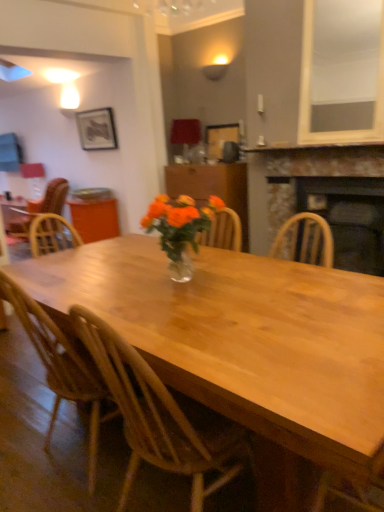
How much space does matte black picture frame at upper left, which ranks as the first picture frame in left-to-right order, occupy horizontally?

3.32 inches.

What is the approximate height of wooden at left, which is the 2th chair in right-to-left order?

The height of wooden at left, which is the 2th chair in right-to-left order, is 38.18 inches.

What do you see at coordinates (212, 187) in the screenshot? I see `wooden cabinet at center` at bounding box center [212, 187].

The width and height of the screenshot is (384, 512). Find the location of `wooden chair at center, the third chair viewed from the back`. wooden chair at center, the third chair viewed from the back is located at coordinates (159, 417).

This screenshot has height=512, width=384. I want to click on translucent glass vase at center, so click(x=179, y=228).

In terms of width, does rustic stone fireplace at right, marked as the second fireplace in a bottom-to-top arrangement, look wider or thinner when compared to matte black picture frame at upper left, the second picture frame positioned from the right?

Clearly, rustic stone fireplace at right, marked as the second fireplace in a bottom-to-top arrangement, has more width compared to matte black picture frame at upper left, the second picture frame positioned from the right.

From a real-world perspective, is rustic stone fireplace at right, which ranks as the 1th fireplace in top-to-bottom order, over matte black picture frame at upper left, which ranks as the first picture frame in left-to-right order?

No, from a real-world perspective, rustic stone fireplace at right, which ranks as the 1th fireplace in top-to-bottom order, is not over matte black picture frame at upper left, which ranks as the first picture frame in left-to-right order

Is rustic stone fireplace at right, marked as the second fireplace in a bottom-to-top arrangement, at the right side of matte black picture frame at upper left, which ranks as the first picture frame in left-to-right order?

Yes.

Is rustic stone fireplace at right, marked as the second fireplace in a bottom-to-top arrangement, oriented away from matte black picture frame at upper left, the second picture frame when ordered from front to back?

rustic stone fireplace at right, marked as the second fireplace in a bottom-to-top arrangement, is not turned away from matte black picture frame at upper left, the second picture frame when ordered from front to back.

Does wooden picture frame at upper center, the 1th picture frame when ordered from bottom to top, appear on the right side of wooden chair at center, the 1th chair in the front-to-back sequence?

Yes, wooden picture frame at upper center, the 1th picture frame when ordered from bottom to top, is to the right of wooden chair at center, the 1th chair in the front-to-back sequence.

Image resolution: width=384 pixels, height=512 pixels. In order to click on picture frame on the right of wooden chair at center, the 3th chair in the left-to-right sequence in this screenshot , I will do `click(220, 138)`.

Looking at this image, does wooden picture frame at upper center, placed as the 1th picture frame when sorted from front to back, have a smaller size compared to wooden chair at center, the 1th chair in the front-to-back sequence?

Indeed, wooden picture frame at upper center, placed as the 1th picture frame when sorted from front to back, has a smaller size compared to wooden chair at center, the 1th chair in the front-to-back sequence.

Does point (66, 338) come closer to viewer compared to point (222, 130)?

Yes, it is.

What's the angular difference between wooden at left, which ranks as the 2th chair in left-to-right order, and wooden picture frame at upper center, which is the second picture frame from left to right,'s facing directions?

There is a 179-degree angle between the facing directions of wooden at left, which ranks as the 2th chair in left-to-right order, and wooden picture frame at upper center, which is the second picture frame from left to right.

Are wooden at left, which is counted as the 2th chair, starting from the back, and wooden picture frame at upper center, the 1th picture frame when ordered from bottom to top, located far from each other?

Yes, wooden at left, which is counted as the 2th chair, starting from the back, is far from wooden picture frame at upper center, the 1th picture frame when ordered from bottom to top.

Is wooden at left, which is the 2th chair in right-to-left order, spatially inside wooden picture frame at upper center, which is the second picture frame from left to right, or outside of it?

wooden at left, which is the 2th chair in right-to-left order, is located beyond the bounds of wooden picture frame at upper center, which is the second picture frame from left to right.

From the image's perspective, is wooden picture frame at upper center, marked as the first picture frame in a right-to-left arrangement, on top of matte black picture frame at upper left, positioned as the 1th picture frame in top-to-bottom order?

No, from the image's perspective, wooden picture frame at upper center, marked as the first picture frame in a right-to-left arrangement, is not over matte black picture frame at upper left, positioned as the 1th picture frame in top-to-bottom order.

Looking at the image, does wooden picture frame at upper center, which appears as the 2th picture frame when viewed from the top, seem bigger or smaller compared to matte black picture frame at upper left, the second picture frame when ordered from front to back?

Clearly, wooden picture frame at upper center, which appears as the 2th picture frame when viewed from the top, is smaller in size than matte black picture frame at upper left, the second picture frame when ordered from front to back.

Is point (238, 126) behind point (98, 137)?

No, (238, 126) is in front of (98, 137).

Is point (209, 139) positioned after point (292, 150)?

Yes, it is behind point (292, 150).

Is wooden picture frame at upper center, marked as the first picture frame in a right-to-left arrangement, in contact with stone fireplace at upper center?

No, wooden picture frame at upper center, marked as the first picture frame in a right-to-left arrangement, is not making contact with stone fireplace at upper center.

From a real-world perspective, is wooden picture frame at upper center, placed as the 1th picture frame when sorted from front to back, on top of stone fireplace at upper center?

Yes.

Which object is positioned more to the right, wooden picture frame at upper center, placed as the 1th picture frame when sorted from front to back, or stone fireplace at upper center?

From the viewer's perspective, stone fireplace at upper center appears more on the right side.

Is wooden chair at left, acting as the first chair starting from the left, not near wooden picture frame at upper center, the 2th picture frame from the back?

That's right, there is a large distance between wooden chair at left, acting as the first chair starting from the left, and wooden picture frame at upper center, the 2th picture frame from the back.

The width and height of the screenshot is (384, 512). I want to click on the 1st picture frame positioned above the wooden chair at left, which is the 3th chair from front to back (from the image's perspective), so click(220, 138).

From the image's perspective, which is below, wooden chair at left, arranged as the first chair when viewed from the back, or wooden picture frame at upper center, the 1th picture frame when ordered from bottom to top?

wooden chair at left, arranged as the first chair when viewed from the back, from the image's perspective.

Which is in front, point (23, 221) or point (228, 131)?

The point (23, 221) is more forward.

Is wooden chair at center, the third chair viewed from the back, not inside rustic stone fireplace at right, which ranks as the 1th fireplace in top-to-bottom order?

Absolutely, wooden chair at center, the third chair viewed from the back, is external to rustic stone fireplace at right, which ranks as the 1th fireplace in top-to-bottom order.

Considering the sizes of objects wooden chair at center, the third chair viewed from the back, and rustic stone fireplace at right, which ranks as the 1th fireplace in top-to-bottom order, in the image provided, who is bigger, wooden chair at center, the third chair viewed from the back, or rustic stone fireplace at right, which ranks as the 1th fireplace in top-to-bottom order,?

rustic stone fireplace at right, which ranks as the 1th fireplace in top-to-bottom order, is bigger.

From a real-world perspective, between wooden chair at center, the 1th chair in the front-to-back sequence, and rustic stone fireplace at right, which ranks as the 1th fireplace in top-to-bottom order, who is vertically lower?

wooden chair at center, the 1th chair in the front-to-back sequence.

Identify the location of the 2nd fireplace in front of the matte black picture frame at upper left, marked as the first picture frame in a back-to-front arrangement. This screenshot has width=384, height=512. (329, 197).

Locate an element on the screen. The height and width of the screenshot is (512, 384). chair that is the 3rd one below the wooden picture frame at upper center, which is the second picture frame from left to right (from a real-world perspective) is located at coordinates (159, 417).

Which object lies further to the anchor point translucent glass vase at center, wooden picture frame at upper center, which appears as the 2th picture frame when viewed from the top, or rustic stone fireplace at right, marked as the second fireplace in a bottom-to-top arrangement?

wooden picture frame at upper center, which appears as the 2th picture frame when viewed from the top, lies further to translucent glass vase at center than the other object.

Looking at the image, which one is located closer to wooden picture frame at upper center, the 2th picture frame from the back, translucent glass vase at center or stone fireplace at upper center?

stone fireplace at upper center lies closer to wooden picture frame at upper center, the 2th picture frame from the back, than the other object.

Which object lies further to the anchor point wooden picture frame at upper center, the 1th picture frame when ordered from bottom to top, rustic stone fireplace at right, marked as the second fireplace in a bottom-to-top arrangement, or black stone fireplace at center, which is the 1th fireplace in bottom-to-top order?

black stone fireplace at center, which is the 1th fireplace in bottom-to-top order, lies further to wooden picture frame at upper center, the 1th picture frame when ordered from bottom to top, than the other object.

From the picture: Considering their positions, is rustic stone fireplace at right, marked as the second fireplace in a bottom-to-top arrangement, positioned closer to black stone fireplace at center, which is the 1th fireplace in bottom-to-top order, than stone fireplace at upper center?

Among the two, rustic stone fireplace at right, marked as the second fireplace in a bottom-to-top arrangement, is located nearer to black stone fireplace at center, which is the 1th fireplace in bottom-to-top order.

Based on their spatial positions, is wooden chair at center, acting as the 1th chair starting from the right, or rustic stone fireplace at right, marked as the second fireplace in a bottom-to-top arrangement, closer to wooden chair at left, arranged as the first chair when viewed from the back?

rustic stone fireplace at right, marked as the second fireplace in a bottom-to-top arrangement.

In the scene shown: Looking at the image, which one is located further to wooden chair at center, the 3th chair in the left-to-right sequence, wooden chair at left, acting as the first chair starting from the left, or wooden picture frame at upper center, marked as the first picture frame in a right-to-left arrangement?

wooden chair at left, acting as the first chair starting from the left, lies further to wooden chair at center, the 3th chair in the left-to-right sequence, than the other object.

Looking at the image, which one is located further to matte black picture frame at upper left, positioned as the 1th picture frame in top-to-bottom order, wooden chair at left, which appears as the 3th chair when viewed from the right, or wooden chair at center, the third chair viewed from the back?

Among the two, wooden chair at center, the third chair viewed from the back, is located further to matte black picture frame at upper left, positioned as the 1th picture frame in top-to-bottom order.

Which object lies nearer to the anchor point wooden cabinet at center, wooden picture frame at upper center, placed as the 1th picture frame when sorted from front to back, or translucent glass vase at center?

wooden picture frame at upper center, placed as the 1th picture frame when sorted from front to back, is closer to wooden cabinet at center.

The image size is (384, 512). What are the coordinates of `mantle positioned between translucent glass vase at center and wooden chair at left, which is the 3th chair from front to back, from near to far` in the screenshot? It's located at (314, 147).

Where is `mantle positioned between wooden chair at center, acting as the 1th chair starting from the right, and wooden chair at left, acting as the first chair starting from the left, from near to far`? The image size is (384, 512). mantle positioned between wooden chair at center, acting as the 1th chair starting from the right, and wooden chair at left, acting as the first chair starting from the left, from near to far is located at coordinates (314, 147).

Identify the location of cabinetry between translucent glass vase at center and matte black picture frame at upper left, marked as the first picture frame in a back-to-front arrangement, along the z-axis. (212, 187).

Locate an element on the screen. The width and height of the screenshot is (384, 512). chair between wooden chair at center, the 3th chair in the left-to-right sequence, and wooden picture frame at upper center, the 2th picture frame from the back, from front to back is located at coordinates (61, 368).